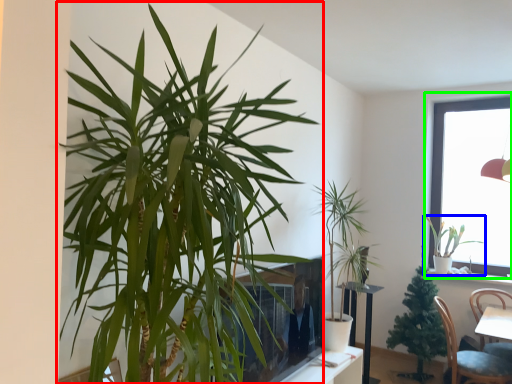
Question: Considering the real-world distances, which object is closest to houseplant (highlighted by a red box)? houseplant (highlighted by a blue box) or window (highlighted by a green box).

Choices:
 (A) houseplant
 (B) window

Answer: (B)